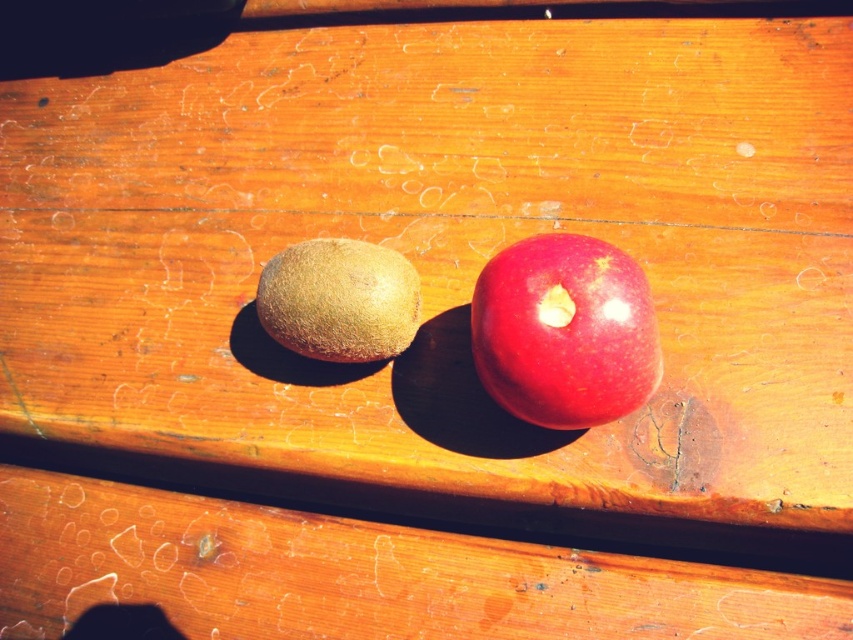
Question: Is glossy red apple at center smaller than brown fuzzy kiwi at center?

Choices:
 (A) yes
 (B) no

Answer: (B)

Question: Does glossy red apple at center appear under brown fuzzy kiwi at center?

Choices:
 (A) yes
 (B) no

Answer: (A)

Question: Which object is closer to the camera taking this photo?

Choices:
 (A) brown fuzzy kiwi at center
 (B) glossy red apple at center

Answer: (B)

Question: Does glossy red apple at center appear on the right side of brown fuzzy kiwi at center?

Choices:
 (A) no
 (B) yes

Answer: (B)

Question: Among these points, which one is farthest from the camera?

Choices:
 (A) (289, 291)
 (B) (614, 262)

Answer: (A)